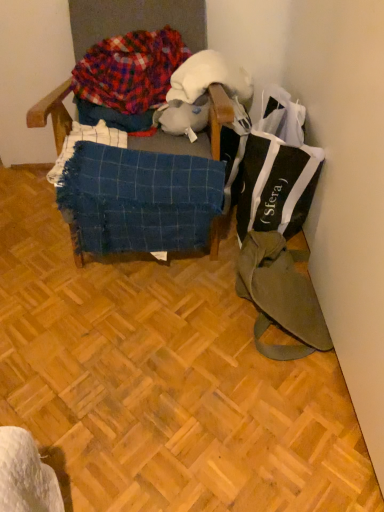
Question: Can you confirm if wooden parquet floor at center is positioned to the right of olive green canvas messenger bag at lower right?

Choices:
 (A) yes
 (B) no

Answer: (B)

Question: Is wooden parquet floor at center positioned with its back to olive green canvas messenger bag at lower right?

Choices:
 (A) no
 (B) yes

Answer: (A)

Question: From a real-world perspective, is wooden parquet floor at center below olive green canvas messenger bag at lower right?

Choices:
 (A) yes
 (B) no

Answer: (A)

Question: Does wooden parquet floor at center have a greater width compared to olive green canvas messenger bag at lower right?

Choices:
 (A) no
 (B) yes

Answer: (B)

Question: Considering the relative positions of wooden parquet floor at center and olive green canvas messenger bag at lower right in the image provided, is wooden parquet floor at center to the left of olive green canvas messenger bag at lower right from the viewer's perspective?

Choices:
 (A) yes
 (B) no

Answer: (A)

Question: From a real-world perspective, is blue woven blanket at center above or below olive green canvas messenger bag at lower right?

Choices:
 (A) above
 (B) below

Answer: (A)

Question: From the image's perspective, is blue woven blanket at center above or below olive green canvas messenger bag at lower right?

Choices:
 (A) above
 (B) below

Answer: (A)

Question: In the image, is blue woven blanket at center on the left side or the right side of olive green canvas messenger bag at lower right?

Choices:
 (A) left
 (B) right

Answer: (A)

Question: Is blue woven blanket at center taller or shorter than olive green canvas messenger bag at lower right?

Choices:
 (A) short
 (B) tall

Answer: (B)

Question: Is white plush toy at center bigger or smaller than plaid fabric at upper left?

Choices:
 (A) big
 (B) small

Answer: (B)

Question: From a real-world perspective, relative to plaid fabric at upper left, is white plush toy at center vertically above or below?

Choices:
 (A) above
 (B) below

Answer: (B)

Question: Based on their positions, is white plush toy at center located to the left or right of plaid fabric at upper left?

Choices:
 (A) left
 (B) right

Answer: (B)

Question: From the image's perspective, is white plush toy at center above or below plaid fabric at upper left?

Choices:
 (A) above
 (B) below

Answer: (B)

Question: From a real-world perspective, is blue woven blanket at center above or below white plush toy at center?

Choices:
 (A) above
 (B) below

Answer: (B)

Question: Considering the positions of blue woven blanket at center and white plush toy at center in the image, is blue woven blanket at center taller or shorter than white plush toy at center?

Choices:
 (A) short
 (B) tall

Answer: (B)